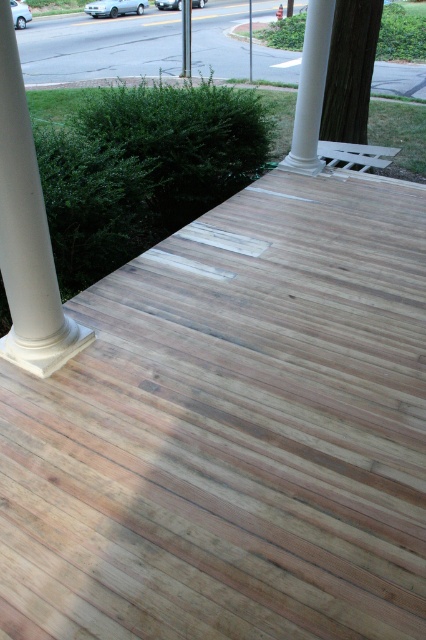
Question: Which point is closer to the camera?

Choices:
 (A) (302, 81)
 (B) (34, 339)

Answer: (B)

Question: Which point appears closest to the camera in this image?

Choices:
 (A) (296, 108)
 (B) (68, 353)

Answer: (B)

Question: Can you confirm if white smooth column at left is positioned to the left of white smooth column at upper center?

Choices:
 (A) yes
 (B) no

Answer: (A)

Question: Can you confirm if white smooth column at left is positioned to the left of white smooth column at upper center?

Choices:
 (A) yes
 (B) no

Answer: (A)

Question: Is white smooth column at left closer to the viewer compared to white smooth column at upper center?

Choices:
 (A) no
 (B) yes

Answer: (B)